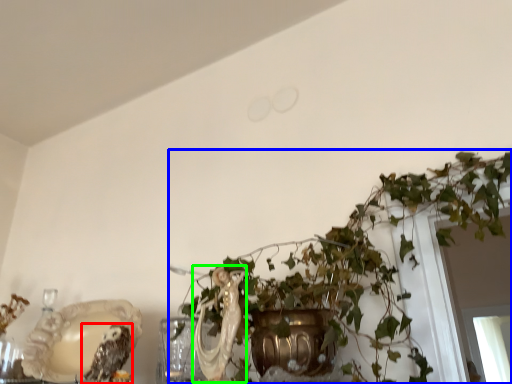
Question: Considering the real-world distances, which object is farthest from owl (highlighted by a red box)? houseplant (highlighted by a blue box) or animal (highlighted by a green box)?

Choices:
 (A) houseplant
 (B) animal

Answer: (A)